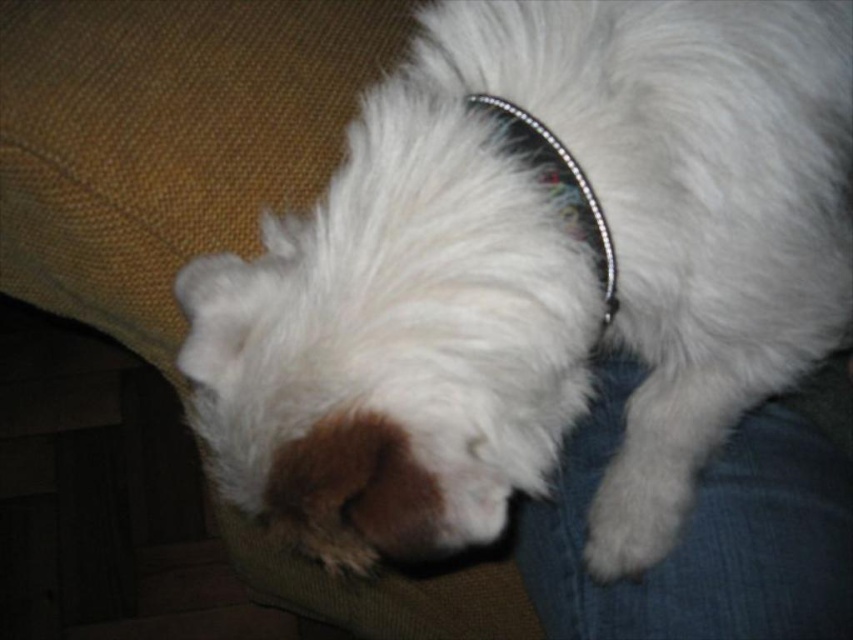
Consider the image. You are a photographer setting up a close shot of the white fluffy dog at center and the sparkly silver dog collar at center. Since you want to ensure both are in focus, which object should you prioritize focusing on first based on their size in the frame?

The white fluffy dog at center has a greater height compared to the sparkly silver dog collar at center, so you should focus on the white fluffy dog at center first as it is larger and occupies more space in the frame.

You are a dog groomer assessing the white fluffy dog at center and the sparkly silver dog collar at center. Which object is closer to the viewer?

The white fluffy dog at center is positioned under the sparkly silver dog collar at center, so the collar is closer to the viewer than the dog.

Based on the photo, you are a photographer trying to capture the white fluffy dog at center. The camera you are using has a focus point at coordinate point (534,275). Will the focus point successfully capture the white fluffy dog at center?

Yes, the focus point at coordinate point (534,275) will successfully capture the white fluffy dog at center because the dog is exactly located at that coordinate.